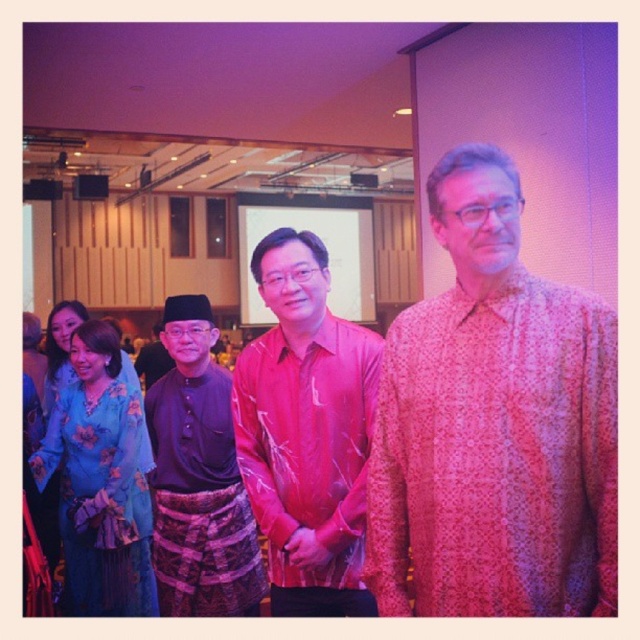
Between pink floral shirt at center and pink printed shirt at center, which one has less height?

With less height is pink floral shirt at center.

Describe the element at coordinates (493, 426) in the screenshot. I see `pink floral shirt at center` at that location.

Where is `pink floral shirt at center`? The width and height of the screenshot is (640, 640). pink floral shirt at center is located at coordinates (493, 426).

Between point (260, 262) and point (100, 481), which one is positioned behind?

The point (100, 481) is more distant.

Is point (300, 428) positioned in front of point (106, 348)?

Yes.

The image size is (640, 640). I want to click on pink printed shirt at center, so click(x=307, y=432).

Is point (419, 388) farther from viewer compared to point (157, 472)?

No, (419, 388) is in front of (157, 472).

What are the coordinates of `pink floral shirt at center` in the screenshot? It's located at (493, 426).